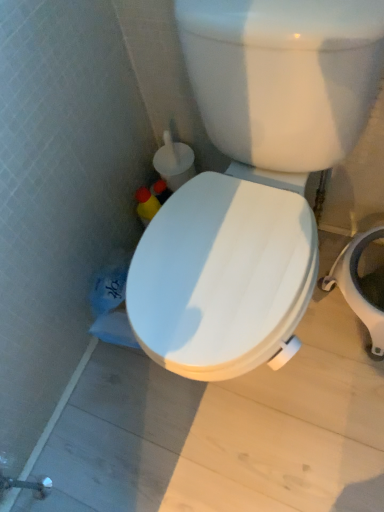
Question: Based on their sizes in the image, would you say white glossy toilet seat at center is bigger or smaller than white plastic bidet at right?

Choices:
 (A) small
 (B) big

Answer: (B)

Question: Considering their positions, is white glossy toilet seat at center located in front of or behind white plastic bidet at right?

Choices:
 (A) behind
 (B) front

Answer: (B)

Question: Is white glossy toilet seat at center wider or thinner than white plastic bidet at right?

Choices:
 (A) thin
 (B) wide

Answer: (B)

Question: Considering the positions of point (374, 232) and point (150, 264), is point (374, 232) closer or farther from the camera than point (150, 264)?

Choices:
 (A) farther
 (B) closer

Answer: (A)

Question: Is white plastic bidet at right wider or thinner than white glossy toilet seat at center?

Choices:
 (A) wide
 (B) thin

Answer: (B)

Question: Would you say white plastic bidet at right is to the left or to the right of white glossy toilet seat at center in the picture?

Choices:
 (A) left
 (B) right

Answer: (B)

Question: Considering the positions of white plastic bidet at right and white glossy toilet seat at center in the image, is white plastic bidet at right bigger or smaller than white glossy toilet seat at center?

Choices:
 (A) big
 (B) small

Answer: (B)